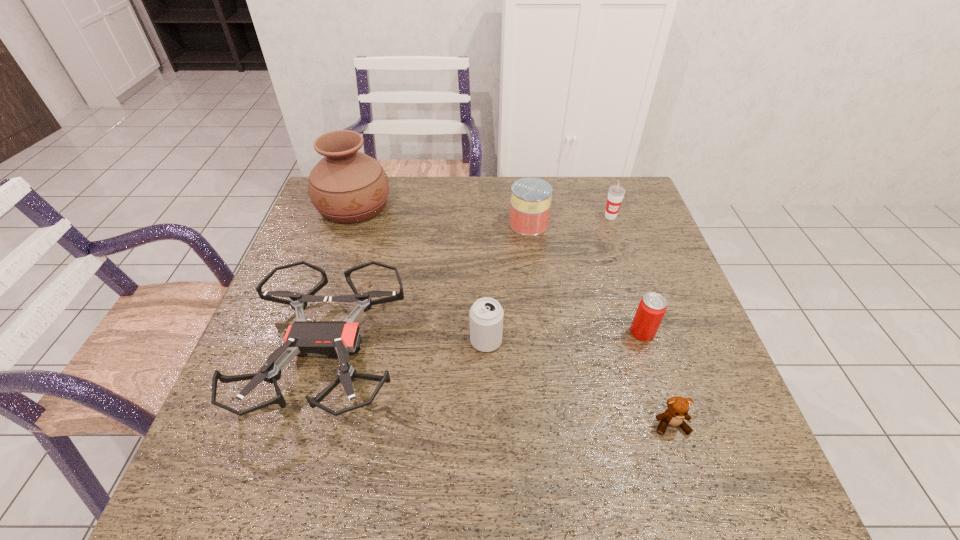
The height and width of the screenshot is (540, 960). In order to click on free location at the far right corner in this screenshot , I will do `click(634, 190)`.

The width and height of the screenshot is (960, 540). In the image, there is a desktop. Identify the location of blank space at the near right corner. (736, 474).

This screenshot has width=960, height=540. Identify the location of vacant space in between the second can from left to right and the urn. (442, 214).

Where is `free space between the drone and the farthest can`? This screenshot has width=960, height=540. free space between the drone and the farthest can is located at coordinates (427, 287).

The height and width of the screenshot is (540, 960). I want to click on empty location between the teddy bear and the leftmost can, so click(579, 383).

Locate an element on the screen. This screenshot has width=960, height=540. empty space between the drone and the fourth object from left to right is located at coordinates (427, 287).

Find the location of `free spot between the farthest can and the leftmost can`. free spot between the farthest can and the leftmost can is located at coordinates (508, 282).

Where is `free space that is in between the rightmost can and the urn`? The height and width of the screenshot is (540, 960). free space that is in between the rightmost can and the urn is located at coordinates (498, 269).

I want to click on vacant space that is in between the rightmost can and the cup, so click(627, 274).

Identify the location of free spot between the farthest can and the cup. This screenshot has width=960, height=540. (569, 220).